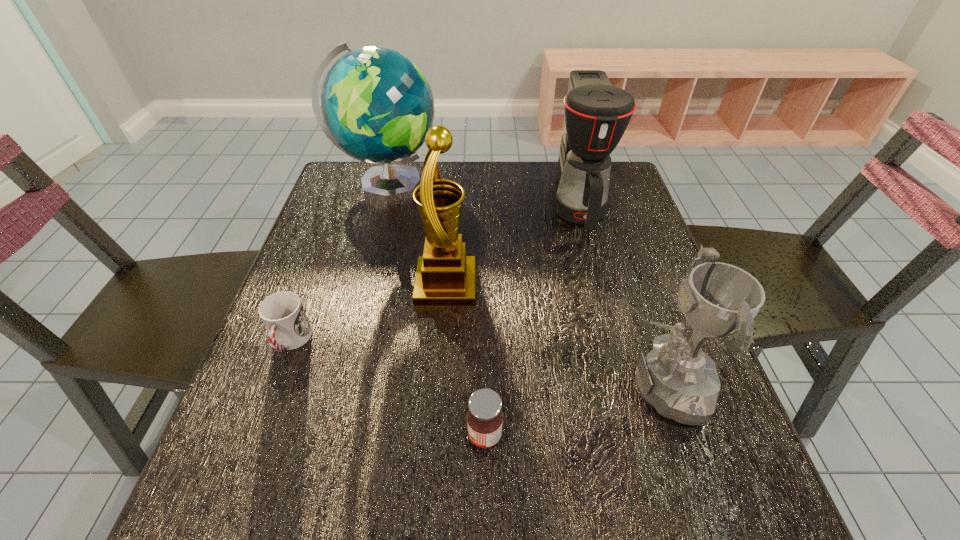
The height and width of the screenshot is (540, 960). I want to click on free spot between the globe and the coffee maker, so click(483, 195).

Where is `object that is the third closest to the globe`? Image resolution: width=960 pixels, height=540 pixels. object that is the third closest to the globe is located at coordinates (282, 313).

Where is `object that can be found as the fifth closest to the farther award`? object that can be found as the fifth closest to the farther award is located at coordinates (678, 379).

The width and height of the screenshot is (960, 540). I want to click on free space that satisfies the following two spatial constraints: 1. on the front-facing side of the taller award; 2. on the side of the shortest object where the handle is located, so click(x=442, y=341).

Find the location of a particular element. vacant space that satisfies the following two spatial constraints: 1. pour from the carafe of the coffee maker; 2. on the front-facing side of the fourth nearest object is located at coordinates (600, 286).